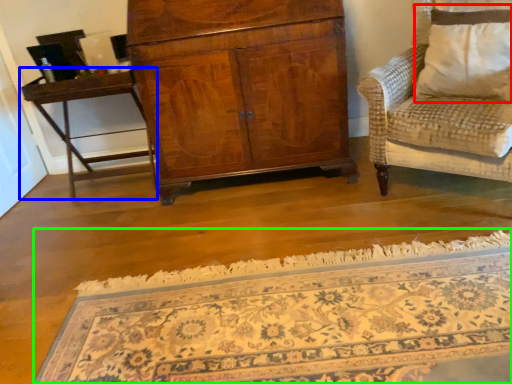
Question: Which object is positioned closest to pillow (highlighted by a red box)? Select from table (highlighted by a blue box) and mat (highlighted by a green box).

Choices:
 (A) table
 (B) mat

Answer: (B)